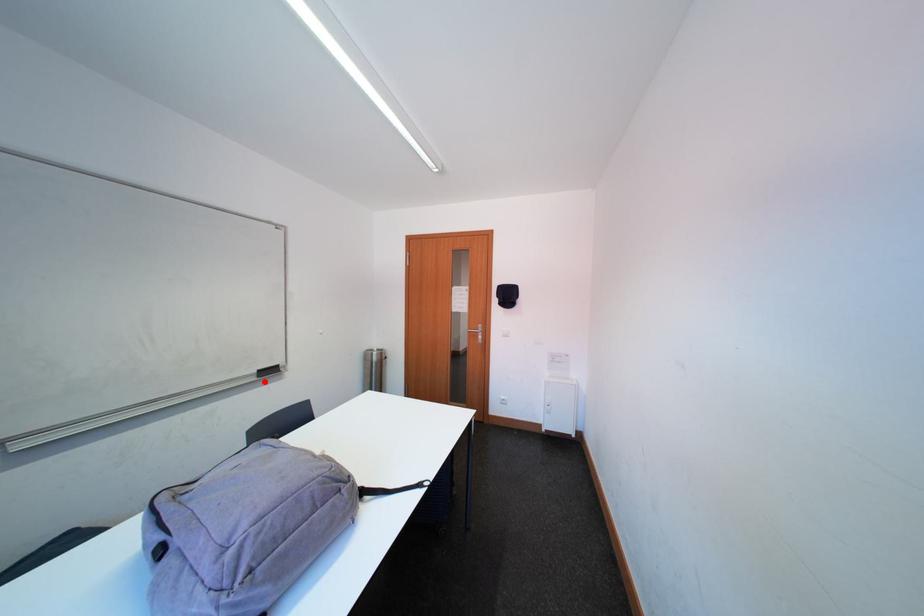
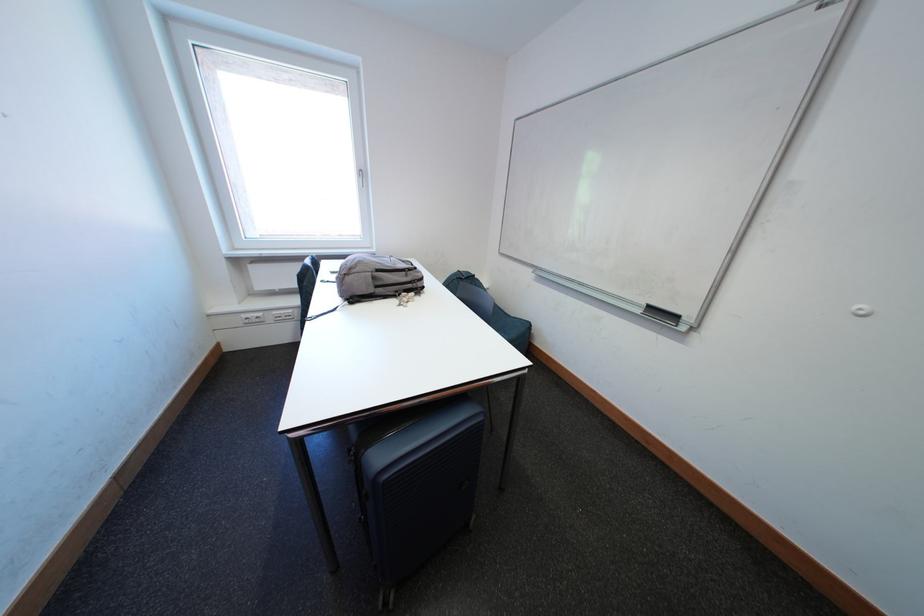
Question: A red point is marked in image1. In image2, is the corresponding 3D point closer to the camera or farther? Reply with the corresponding letter.

Choices:
 (A) The corresponding 3D point is closer.
 (B) The corresponding 3D point is farther.

Answer: (A)